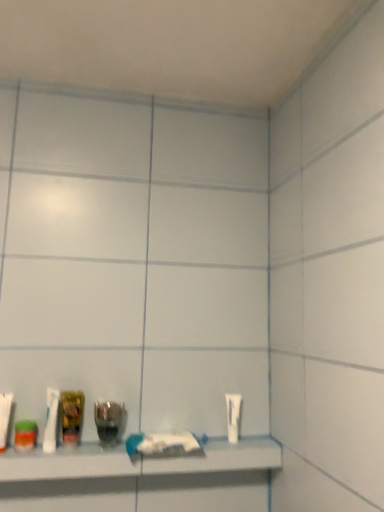
Question: Looking at their shapes, would you say white plastic toothbrush at lower left, which is the 1th toiletry from front to back, is wider or thinner than white matte tube at right, marked as the 1th toiletry in a right-to-left arrangement?

Choices:
 (A) thin
 (B) wide

Answer: (B)

Question: Considering the positions of point (1, 449) and point (235, 413), is point (1, 449) closer or farther from the camera than point (235, 413)?

Choices:
 (A) closer
 (B) farther

Answer: (A)

Question: Which of these objects is positioned farthest from the clear plastic bottle at lower center, the third mouthwash when ordered from left to right?

Choices:
 (A) white plastic toothbrush at lower left, which is the 1th toiletry from front to back
 (B) translucent plastic mouthwash at lower left, marked as the third mouthwash in a right-to-left arrangement
 (C) white glossy shelf at lower center
 (D) white matte tube at right, the second toiletry in the front-to-back sequence
 (E) translucent plastic mouthwash at lower left, positioned as the 2th mouthwash in left-to-right order

Answer: (D)

Question: Which object is the farthest from the white glossy shelf at lower center?

Choices:
 (A) white plastic toothbrush at lower left, acting as the second toiletry starting from the right
 (B) translucent plastic mouthwash at lower left, which appears as the 2th mouthwash when viewed from the right
 (C) translucent plastic mouthwash at lower left, placed as the first mouthwash when sorted from left to right
 (D) clear plastic bottle at lower center, which is the 1th mouthwash in right-to-left order
 (E) white matte tube at right, the second toiletry in the left-to-right sequence

Answer: (A)